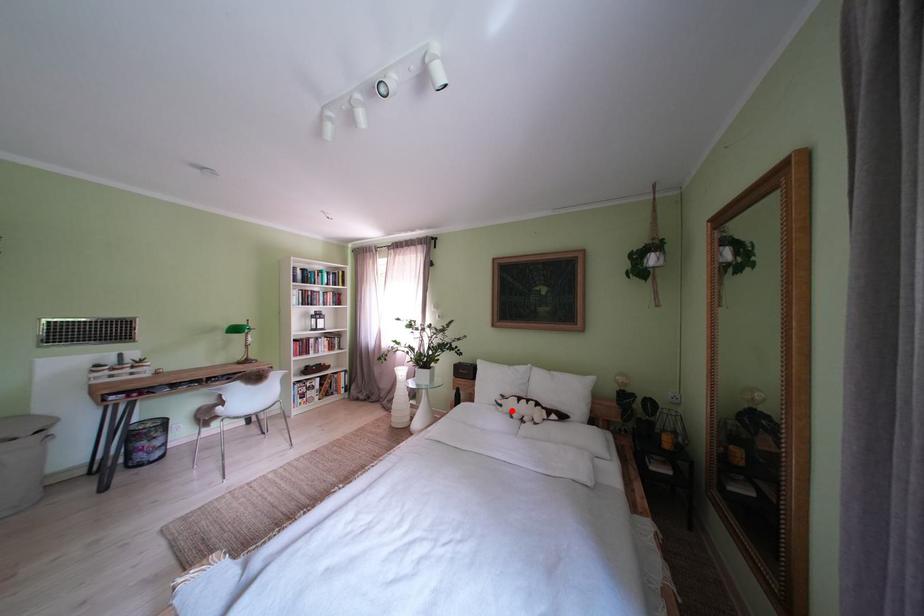
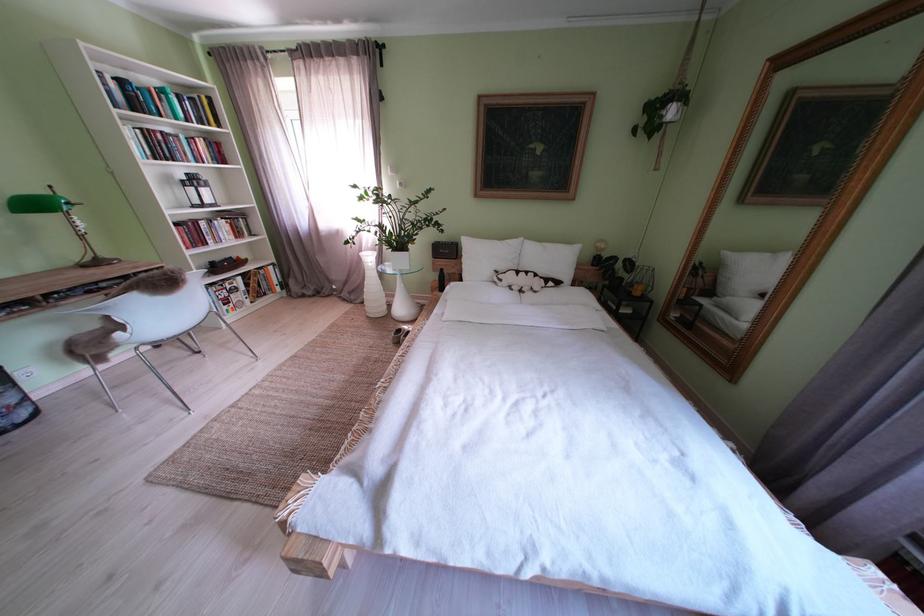
Locate, in the second image, the point that corresponds to the highlighted location in the first image.

(512, 285)